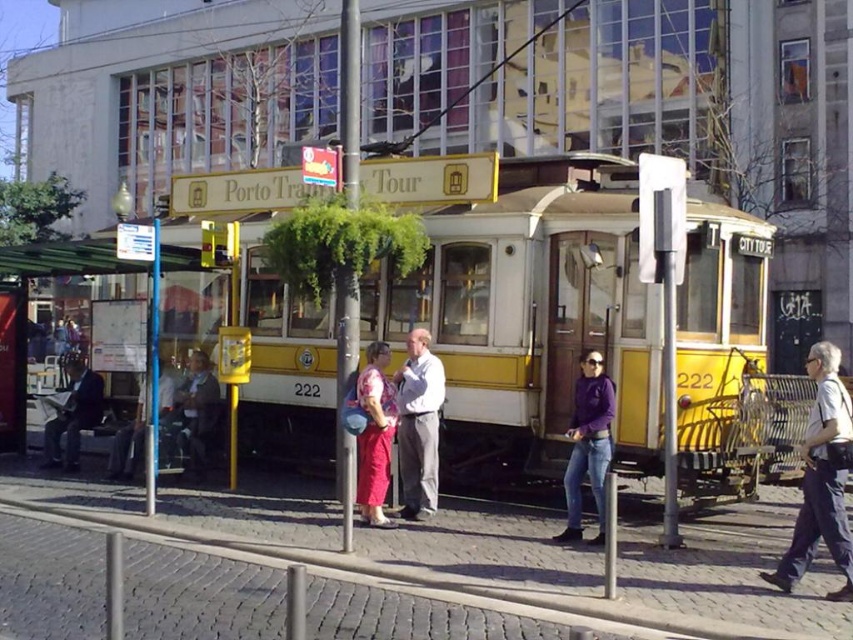
Which is below, light gray pants at lower right or white plastic bench at left?

light gray pants at lower right

Between light gray pants at lower right and white plastic bench at left, which one appears on the left side from the viewer's perspective?

white plastic bench at left is more to the left.

Does point (816, 369) come in front of point (90, 257)?

Yes, point (816, 369) is in front of point (90, 257).

You are a GUI agent. You are given a task and a screenshot of the screen. Output one action in this format:
    pyautogui.click(x=<x>, y=<y>)
    Task: Click on the light gray pants at lower right
    The height and width of the screenshot is (640, 853).
    Given the screenshot: What is the action you would take?
    pyautogui.click(x=822, y=477)

In order to click on matte black suit at left in this screenshot , I will do `click(73, 417)`.

Does matte black suit at left have a greater height compared to light brown leather jacket at center?

Indeed, matte black suit at left has a greater height compared to light brown leather jacket at center.

Does point (73, 400) lie in front of point (113, 472)?

That is False.

In order to click on matte black suit at left in this screenshot , I will do point(73,417).

Who is more distant from viewer, (56, 419) or (187, 410)?

The point (56, 419) is more distant.

Is matte black suit at left further to camera compared to dark brown leather jacket at left?

Yes.

Find the location of a particular element. This screenshot has width=853, height=640. matte black suit at left is located at coordinates (73, 417).